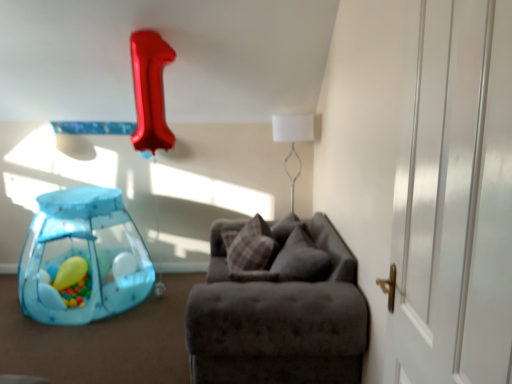
From the picture: How much space does velvet gray pillow at center, which is the first pillow in right-to-left order, occupy vertically?

velvet gray pillow at center, which is the first pillow in right-to-left order, is 17.36 inches tall.

What is the approximate width of white fabric lampshade at upper center?

It is 15.19 inches.

The height and width of the screenshot is (384, 512). I want to click on translucent yellow balloon at lower left, so click(x=70, y=272).

Is suede-like gray couch at center not inside white fabric lampshade at upper center?

suede-like gray couch at center is positioned outside white fabric lampshade at upper center.

Is suede-like gray couch at center not near white fabric lampshade at upper center?

Yes, suede-like gray couch at center is far from white fabric lampshade at upper center.

From a real-world perspective, is suede-like gray couch at center on top of white fabric lampshade at upper center?

Actually, suede-like gray couch at center is physically below white fabric lampshade at upper center in the real world.

From the picture: Can you confirm if white glossy door at right is positioned to the left of velvet gray pillow at center, arranged as the second pillow when viewed from the left?

Incorrect, white glossy door at right is not on the left side of velvet gray pillow at center, arranged as the second pillow when viewed from the left.

At what (x,y) coordinates should I click in order to perform the action: click on the 1st pillow to the left of the white glossy door at right, counting from the anchor's position. Please return your answer as a coordinate pair (x, y). Looking at the image, I should click on [x=301, y=259].

From a real-world perspective, which object rests below the other?

velvet gray pillow at center, which is the first pillow in right-to-left order.

From the image's perspective, which is below, plaid fabric pillow at center, which is the 2th pillow from right to left, or suede-like gray couch at center?

suede-like gray couch at center appears lower in the image.

Based on the photo, is plaid fabric pillow at center, the 1th pillow positioned from the left, next to suede-like gray couch at center and touching it?

plaid fabric pillow at center, the 1th pillow positioned from the left, is not next to suede-like gray couch at center, and they're not touching.

Is point (253, 235) less distant than point (365, 340)?

No.

Is plaid fabric pillow at center, which is the 2th pillow from right to left, positioned with its back to suede-like gray couch at center?

Yes, plaid fabric pillow at center, which is the 2th pillow from right to left,'s orientation is away from suede-like gray couch at center.

From the image's perspective, would you say transparent plastic playpen at lower left is shown under suede-like gray couch at center?

Incorrect, from the image's perspective, transparent plastic playpen at lower left is higher than suede-like gray couch at center.

Which of these two, transparent plastic playpen at lower left or suede-like gray couch at center, is smaller?

With smaller size is transparent plastic playpen at lower left.

Consider the image. Is transparent plastic playpen at lower left inside or outside of suede-like gray couch at center?

transparent plastic playpen at lower left is not inside suede-like gray couch at center, it's outside.

Are transparent plastic playpen at lower left and suede-like gray couch at center making contact?

No, transparent plastic playpen at lower left is not touching suede-like gray couch at center.

Is transparent plastic playpen at lower left in front of white glossy door at right?

No.

Considering the sizes of transparent plastic playpen at lower left and white glossy door at right in the image, is transparent plastic playpen at lower left taller or shorter than white glossy door at right?

Clearly, transparent plastic playpen at lower left is shorter compared to white glossy door at right.

From a real-world perspective, is transparent plastic playpen at lower left physically above white glossy door at right?

No.

Is transparent plastic playpen at lower left facing away from white glossy door at right?

No, white glossy door at right is not at the back of transparent plastic playpen at lower left.

Does point (311, 346) come farther from viewer compared to point (141, 291)?

No.

Which of these two, suede-like gray couch at center or transparent plastic playpen at lower left, is wider?

Wider between the two is suede-like gray couch at center.

Can you confirm if suede-like gray couch at center is positioned to the left of transparent plastic playpen at lower left?

No, suede-like gray couch at center is not to the left of transparent plastic playpen at lower left.

Looking at this image, are translucent yellow balloon at lower left and velvet gray pillow at center, arranged as the second pillow when viewed from the left, located far from each other?

Yes.

This screenshot has height=384, width=512. In order to click on balloon lying on the left of velvet gray pillow at center, which is the first pillow in right-to-left order in this screenshot , I will do `click(70, 272)`.

From a real-world perspective, who is located higher, translucent yellow balloon at lower left or velvet gray pillow at center, which is the first pillow in right-to-left order?

From a 3D spatial view, velvet gray pillow at center, which is the first pillow in right-to-left order, is above.

Can you confirm if translucent yellow balloon at lower left is wider than velvet gray pillow at center, which is the first pillow in right-to-left order?

No, translucent yellow balloon at lower left is not wider than velvet gray pillow at center, which is the first pillow in right-to-left order.

The image size is (512, 384). In the image, there is a white fabric lampshade at upper center. What are the coordinates of `studio couch below it (from a real-world perspective)` in the screenshot? It's located at (278, 320).

Where is `glass door in front of the velvet gray pillow at center, arranged as the second pillow when viewed from the left`? glass door in front of the velvet gray pillow at center, arranged as the second pillow when viewed from the left is located at coordinates pyautogui.click(x=456, y=202).

In the scene shown: When comparing their distances from white fabric lampshade at upper center, does white glossy door at right or translucent yellow balloon at lower left seem closer?

Based on the image, translucent yellow balloon at lower left appears to be nearer to white fabric lampshade at upper center.

Estimate the real-world distances between objects in this image. Which object is further from white fabric lampshade at upper center, suede-like gray couch at center or plaid fabric pillow at center, which is the 2th pillow from right to left?

suede-like gray couch at center.

Which object lies further to the anchor point white glossy door at right, suede-like gray couch at center or translucent yellow balloon at lower left?

translucent yellow balloon at lower left is positioned further to the anchor white glossy door at right.

Considering their positions, is transparent plastic playpen at lower left positioned further to white glossy door at right than suede-like gray couch at center?

transparent plastic playpen at lower left.

From the image, which object appears to be farther from white glossy door at right, translucent yellow balloon at lower left or plaid fabric pillow at center, the 1th pillow positioned from the left?

translucent yellow balloon at lower left lies further to white glossy door at right than the other object.

From the image, which object appears to be nearer to velvet gray pillow at center, arranged as the second pillow when viewed from the left, white fabric lampshade at upper center or translucent yellow balloon at lower left?

white fabric lampshade at upper center lies closer to velvet gray pillow at center, arranged as the second pillow when viewed from the left, than the other object.

Considering their positions, is white glossy door at right positioned closer to translucent yellow balloon at lower left than transparent plastic playpen at lower left?

transparent plastic playpen at lower left is closer to translucent yellow balloon at lower left.

Looking at the image, which one is located further to plaid fabric pillow at center, which is the 2th pillow from right to left, suede-like gray couch at center or transparent plastic playpen at lower left?

The object further to plaid fabric pillow at center, which is the 2th pillow from right to left, is transparent plastic playpen at lower left.

This screenshot has height=384, width=512. I want to click on pillow between white glossy door at right and plaid fabric pillow at center, the 1th pillow positioned from the left, from front to back, so point(301,259).

Image resolution: width=512 pixels, height=384 pixels. What are the coordinates of `pillow between velvet gray pillow at center, arranged as the second pillow when viewed from the left, and white fabric lampshade at upper center in the front-back direction` in the screenshot? It's located at (252, 247).

Locate an element on the screen. pillow between translucent yellow balloon at lower left and suede-like gray couch at center in the horizontal direction is located at coordinates (252, 247).

The image size is (512, 384). Identify the location of pillow between transparent plastic playpen at lower left and suede-like gray couch at center. (252, 247).